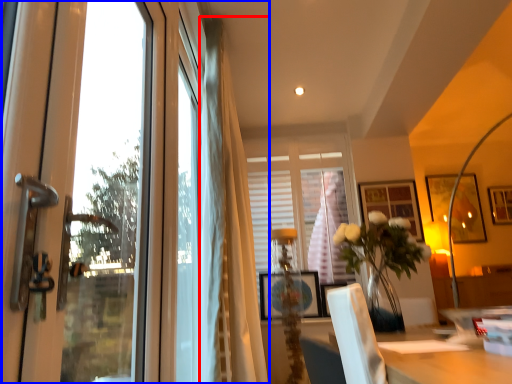
Question: Which point is closer to the camera, curtain (highlighted by a red box) or window (highlighted by a blue box)?

Choices:
 (A) curtain
 (B) window

Answer: (B)